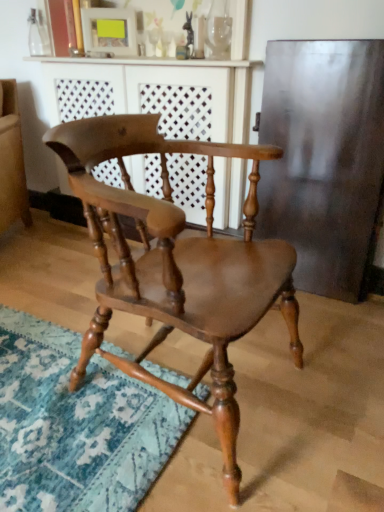
Question: Considering the relative positions of wooden dresser at center and shiny brown wood chair at center in the image provided, is wooden dresser at center to the left or to the right of shiny brown wood chair at center?

Choices:
 (A) left
 (B) right

Answer: (A)

Question: Is wooden dresser at center wider or thinner than shiny brown wood chair at center?

Choices:
 (A) wide
 (B) thin

Answer: (B)

Question: Would you say wooden dresser at center is inside or outside shiny brown wood chair at center?

Choices:
 (A) inside
 (B) outside

Answer: (B)

Question: Is shiny brown wood chair at center wider or thinner than wooden dresser at center?

Choices:
 (A) wide
 (B) thin

Answer: (A)

Question: Is shiny brown wood chair at center spatially inside wooden dresser at center, or outside of it?

Choices:
 (A) outside
 (B) inside

Answer: (A)

Question: Is shiny brown wood chair at center to the left or to the right of wooden dresser at center in the image?

Choices:
 (A) right
 (B) left

Answer: (A)

Question: In terms of size, does shiny brown wood chair at center appear bigger or smaller than wooden dresser at center?

Choices:
 (A) big
 (B) small

Answer: (B)